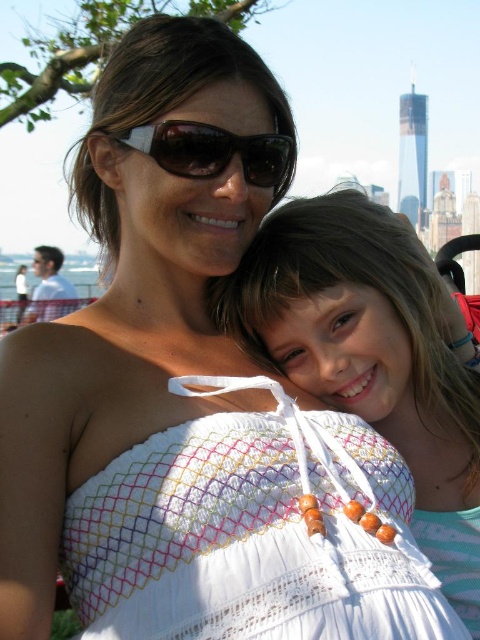
You are a photographer standing at the center of a large field. You see two dresses in front of you, the white crochet dress at center and the white lace dress at center. Which dress is closer to you?

The white lace dress at center is closer to you because the white crochet dress at center is 126.07 meters away from it, meaning the crochet dress is farther away from the photographer.

You are a photographer trying to capture the perfect shot of the scene. You notice a specific point at coordinates (x=249, y=538). Based on the scene description, can you determine which object this point is located on?

The point at coordinates (x=249, y=538) is on the white crochet dress at center.

You are organizing a fashion show and need to display two dresses side by side. Given that both the white crochet dress at center and the white lace dress at center are placed on mannequins, which dress will require a smaller display area based on their sizes?

The white crochet dress at center occupies less space than the white lace dress at center, so it will require a smaller display area.